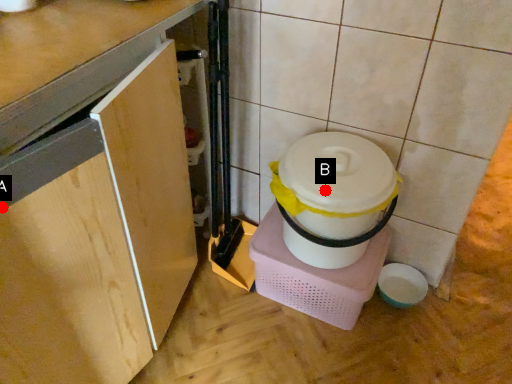
Question: Two points are circled on the image, labeled by A and B beside each circle. Which point is closer to the camera?

Choices:
 (A) A is closer
 (B) B is closer

Answer: (A)